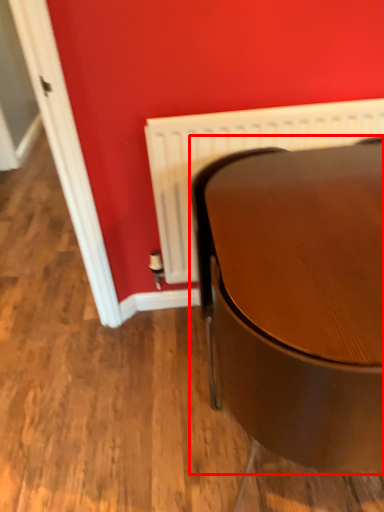
Question: From the image's perspective, where is table (annotated by the red box) located in relation to radiator in the image?

Choices:
 (A) above
 (B) below

Answer: (B)